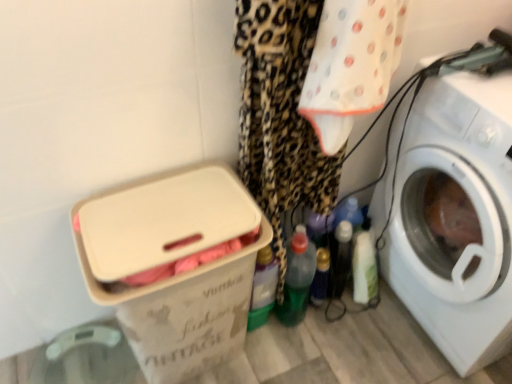
Locate an element on the screen. Image resolution: width=512 pixels, height=384 pixels. vacant space to the right of green plastic bottle at center, which is counted as the second bottle, starting from the right is located at coordinates (340, 328).